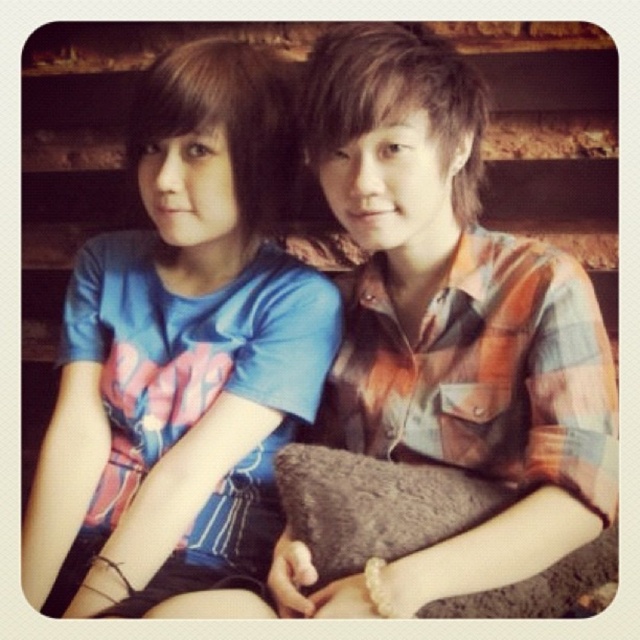
Question: Is plaid shirt at center above blue cotton t-shirt at upper left?

Choices:
 (A) no
 (B) yes

Answer: (B)

Question: Which of the following is the closest to the observer?

Choices:
 (A) brown fuzzy pillow at center
 (B) blue cotton t-shirt at upper left

Answer: (A)

Question: Is blue cotton t-shirt at upper left positioned before brown fuzzy pillow at center?

Choices:
 (A) no
 (B) yes

Answer: (A)

Question: Does plaid shirt at center lie in front of blue cotton t-shirt at upper left?

Choices:
 (A) no
 (B) yes

Answer: (B)

Question: Which point is closer to the camera?

Choices:
 (A) (499, 602)
 (B) (464, 99)

Answer: (A)

Question: Estimate the real-world distances between objects in this image. Which object is closer to the plaid shirt at center?

Choices:
 (A) brown fuzzy pillow at center
 (B) blue cotton t-shirt at upper left

Answer: (A)